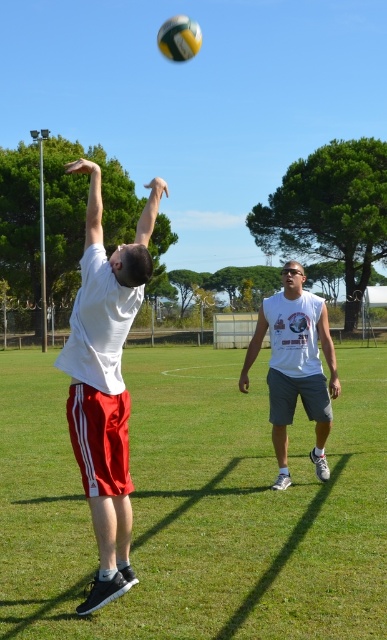
You are standing at the origin of the coordinate system in the volleyball court. The white fabric shorts at center are located at point (198, 506). If you want to move directly towards the white fabric shorts at center, in which direction should you move?

The point (198, 506) is located at the center of the volleyball court, so you should move forward towards the center to reach the white fabric shorts at center.

Consider the image. You are a photographer trying to capture a photo of the volleyball game. You want to ensure both the white matte shirt at left and the yellow matte volleyball at upper center are in the frame. Based on their positions, which object should you focus on first to include both in your shot?

The white matte shirt at left is positioned on the left side of the yellow matte volleyball at upper center, so focusing on the yellow matte volleyball at upper center first would allow you to include both objects in the frame since it is centrally located.

You are a photographer positioned at the center of the volleyball court. You want to capture a photo of the white matte shirt at left. Which direction should you move to get a better shot?

The white matte shirt at left is located at point [106,381], so you should move to the left to get a better shot.